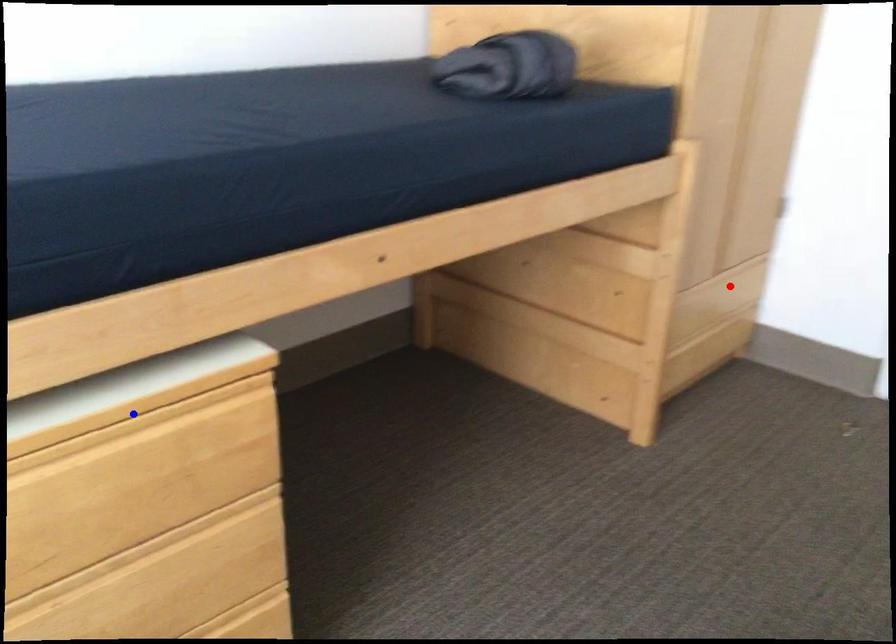
Question: In the image, two points are highlighted. Which point is nearer to the camera? Reply with the corresponding letter.

Choices:
 (A) blue point
 (B) red point

Answer: (A)